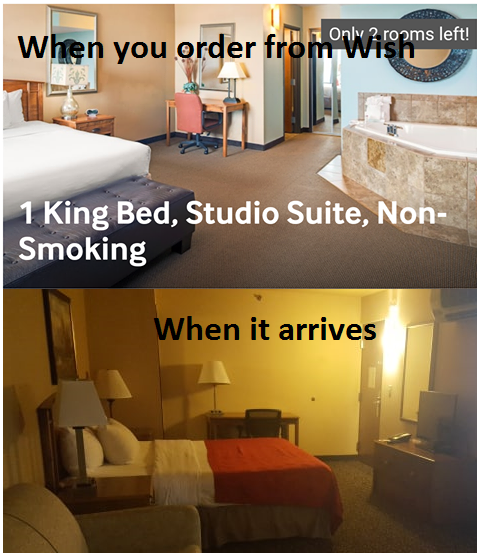
Locate an element on the screen. This screenshot has height=553, width=477. desk chair is located at coordinates (262, 419).